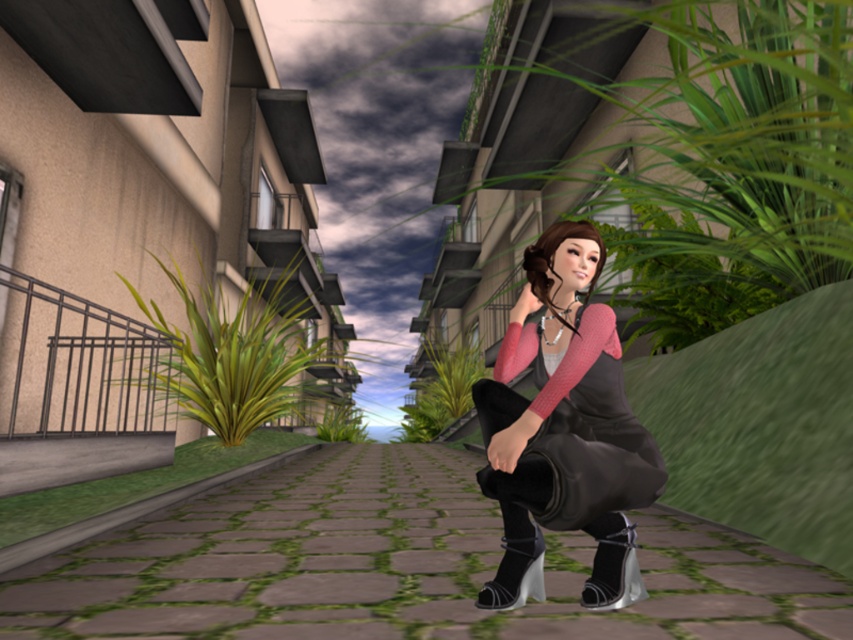
Question: Which point appears farthest from the camera in this image?

Choices:
 (A) (498, 593)
 (B) (521, 356)

Answer: (B)

Question: Does matte black dress at center lie behind black leather boot at lower center?

Choices:
 (A) no
 (B) yes

Answer: (A)

Question: Which point is farther from the camera taking this photo?

Choices:
 (A) (537, 538)
 (B) (614, 524)
 (C) (587, 241)

Answer: (C)

Question: Among these objects, which one is farthest from the camera?

Choices:
 (A) matte black dress at center
 (B) shiny silver boot at lower center

Answer: (B)

Question: Is matte black dress at center positioned in front of shiny silver boot at lower center?

Choices:
 (A) yes
 (B) no

Answer: (A)

Question: Observing the image, what is the correct spatial positioning of matte black dress at center in reference to shiny silver boot at lower center?

Choices:
 (A) above
 (B) below

Answer: (A)